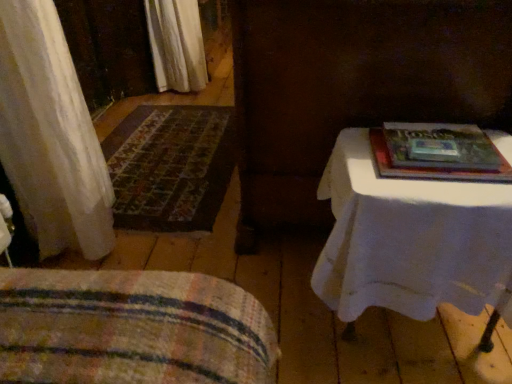
The width and height of the screenshot is (512, 384). Find the location of `vacant area that is in front of hardcover book at upper right`. vacant area that is in front of hardcover book at upper right is located at coordinates (448, 194).